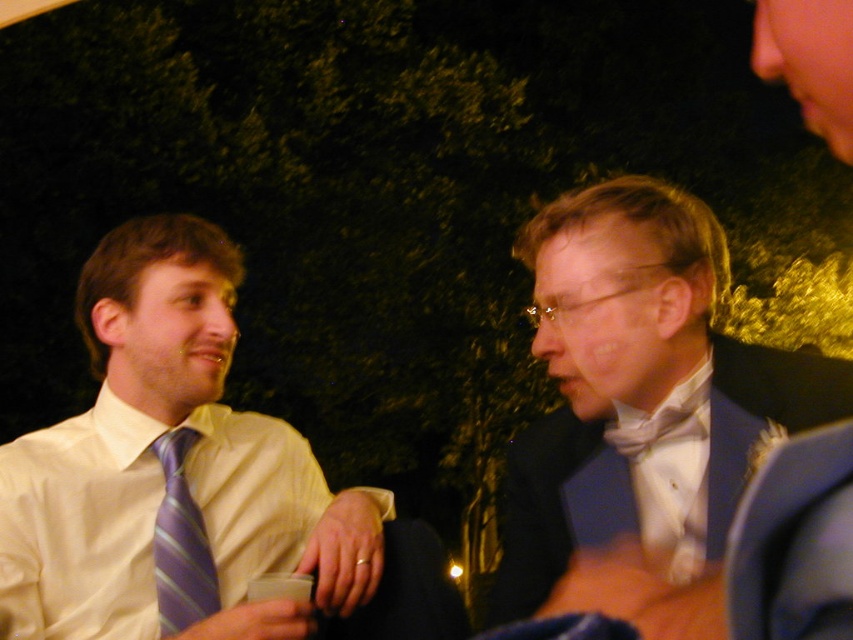
You are standing at the center of the scene and want to walk to the nearest point between point (x=607, y=545) and point (x=196, y=573). Which point should you walk towards?

Point (x=607, y=545) is closer to the viewer than point (x=196, y=573), so you should walk towards point (x=607, y=545).

Based on the scene description, which object is taller between the shiny blue suit at center and the purple striped tie at left?

The shiny blue suit at center is much taller than the purple striped tie at left.